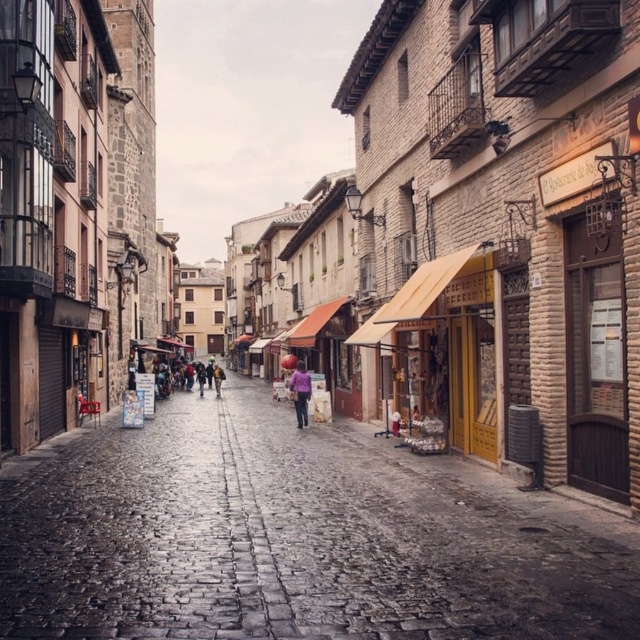
Question: Does cobblestone street at center have a larger size compared to purple fabric umbrella at center?

Choices:
 (A) yes
 (B) no

Answer: (A)

Question: Which of these objects is positioned closest to the cobblestone street at center?

Choices:
 (A) purple fabric at center
 (B) dark purple sweater at center
 (C) purple fabric umbrella at center

Answer: (A)

Question: Can you confirm if cobblestone street at center is bigger than purple fabric umbrella at center?

Choices:
 (A) yes
 (B) no

Answer: (A)

Question: Which object is farther from the camera taking this photo?

Choices:
 (A) purple fabric umbrella at center
 (B) dark purple sweater at center

Answer: (B)

Question: Can you confirm if dark purple sweater at center is thinner than purple fabric umbrella at center?

Choices:
 (A) yes
 (B) no

Answer: (B)

Question: Based on their relative distances, which object is farther from the purple fabric umbrella at center?

Choices:
 (A) dark purple sweater at center
 (B) cobblestone street at center
 (C) purple fabric at center

Answer: (B)